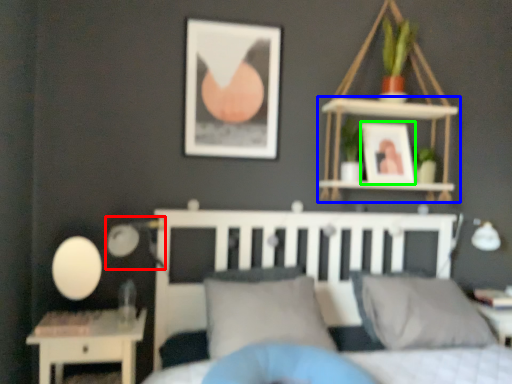
Question: Which is farther away from table lamp (highlighted by a red box)? shelf (highlighted by a blue box) or picture frame (highlighted by a green box)?

Choices:
 (A) shelf
 (B) picture frame

Answer: (B)